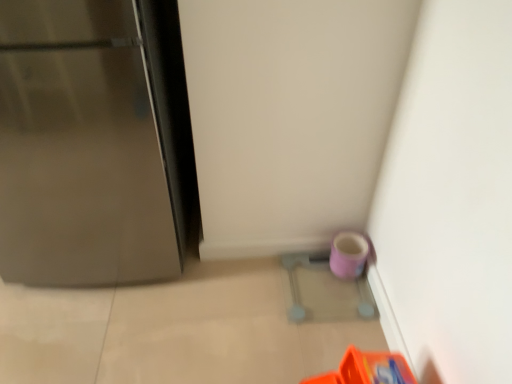
The image size is (512, 384). I want to click on free space in front of satin metallic door at left, so click(x=116, y=337).